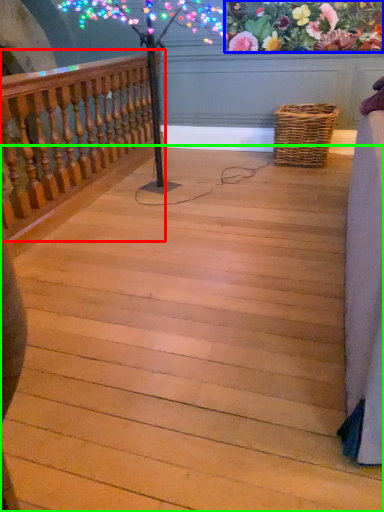
Question: Based on their relative distances, which object is nearer to rail (highlighted by a red box)? Choose from floral arrangement (highlighted by a blue box) and stairs (highlighted by a green box).

Choices:
 (A) floral arrangement
 (B) stairs

Answer: (B)